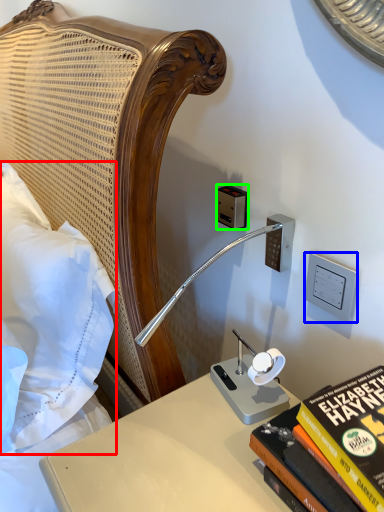
Question: Estimate the real-world distances between objects in this image. Which object is farther from pillow (highlighted by a red box), electric outlet (highlighted by a blue box) or electric outlet (highlighted by a green box)?

Choices:
 (A) electric outlet
 (B) electric outlet

Answer: (A)